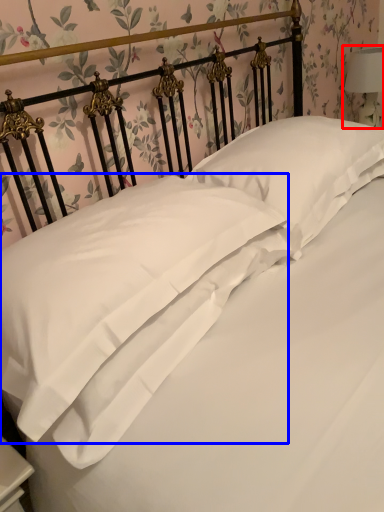
Question: Which point is further to the camera, bedside lamp (highlighted by a red box) or pillow (highlighted by a blue box)?

Choices:
 (A) bedside lamp
 (B) pillow

Answer: (A)